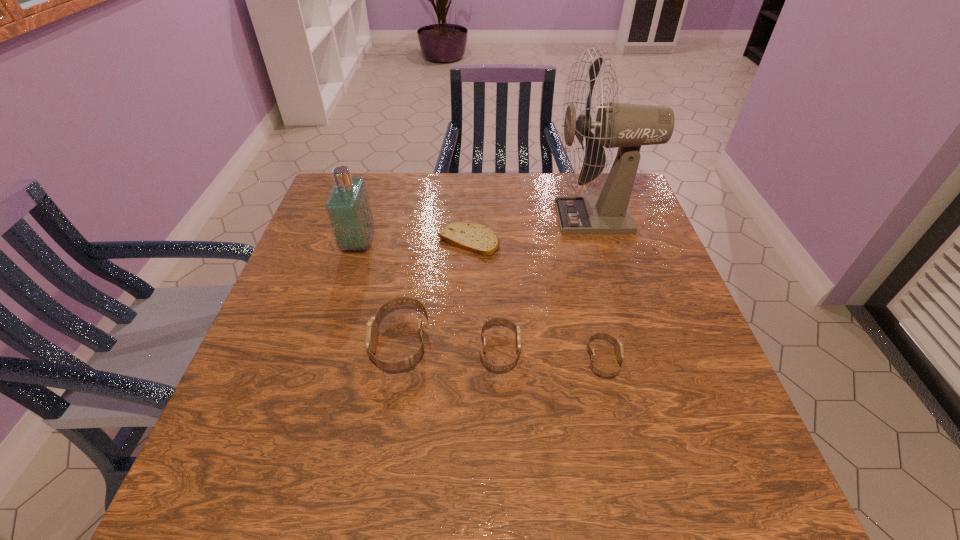
Image resolution: width=960 pixels, height=540 pixels. Identify the location of the tallest watch. (371, 332).

Identify the location of the leftmost watch. (371, 332).

This screenshot has width=960, height=540. I want to click on the second tallest watch, so click(491, 321).

Locate an element on the screen. The height and width of the screenshot is (540, 960). the third shortest object is located at coordinates [491, 321].

Find the location of `the fifth tallest object`. the fifth tallest object is located at coordinates (619, 350).

This screenshot has height=540, width=960. What are the coordinates of `the shortest watch` in the screenshot? It's located at (619, 350).

Locate an element on the screen. perfume is located at coordinates (348, 207).

This screenshot has height=540, width=960. I want to click on the second tallest object, so click(348, 207).

Locate an element on the screen. This screenshot has height=540, width=960. the tallest object is located at coordinates (628, 126).

Where is `the shortest object`? the shortest object is located at coordinates (475, 238).